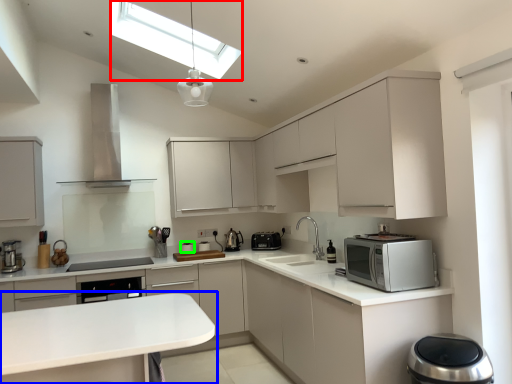
Question: Considering the real-world distances, which object is closest to lighting (highlighted by a red box)? countertop (highlighted by a blue box) or appliance (highlighted by a green box).

Choices:
 (A) countertop
 (B) appliance

Answer: (A)